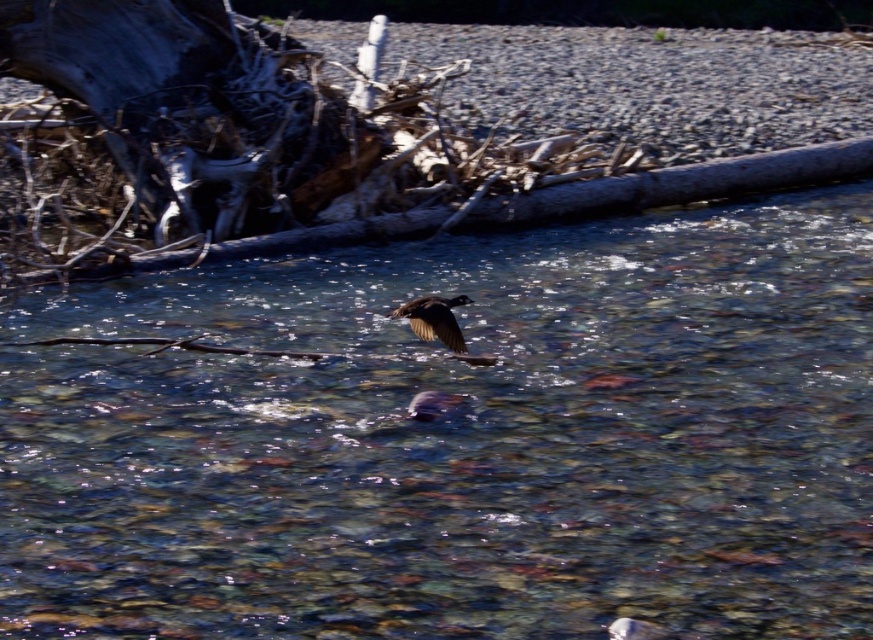
Who is positioned more to the left, clear water at center or dark brown feathers at center?

Positioned to the left is clear water at center.

Is point (12, 406) in front of point (458, 304)?

Yes, it is.

From the picture: Who is more distant from viewer, (733, 428) or (427, 316)?

Point (427, 316)

The image size is (873, 640). Find the location of `clear water at center`. clear water at center is located at coordinates (459, 440).